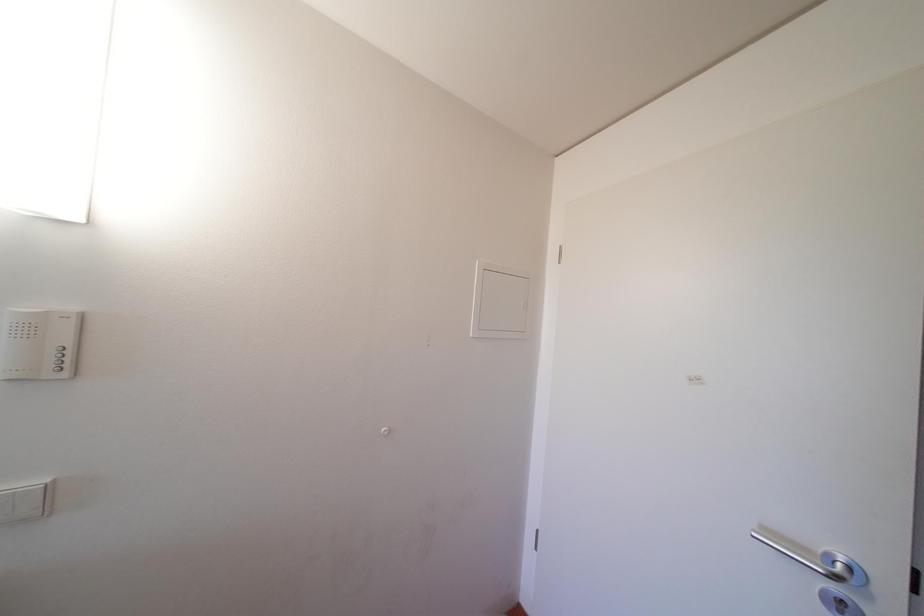
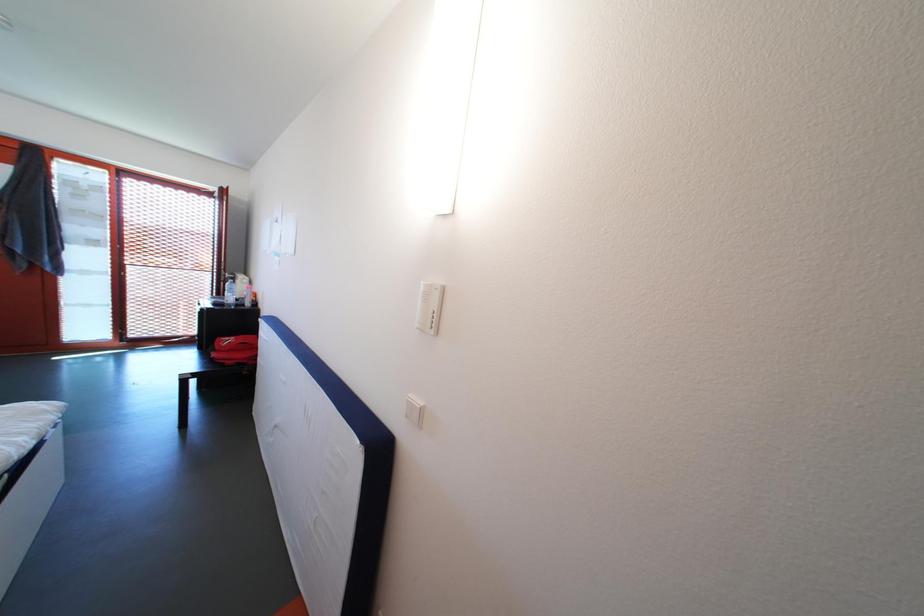
Question: The first image is from the beginning of the video and the second image is from the end. How did the camera likely rotate when shooting the video?

Choices:
 (A) Left
 (B) Right
 (C) Up
 (D) Down

Answer: (A)